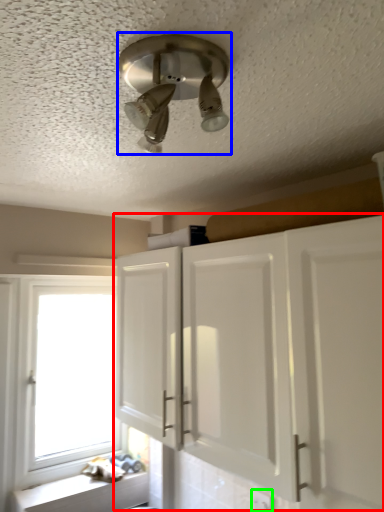
Question: Which object is positioned closest to cabinetry (highlighted by a red box)? Select from light fixture (highlighted by a blue box) and electric outlet (highlighted by a green box).

Choices:
 (A) light fixture
 (B) electric outlet

Answer: (B)